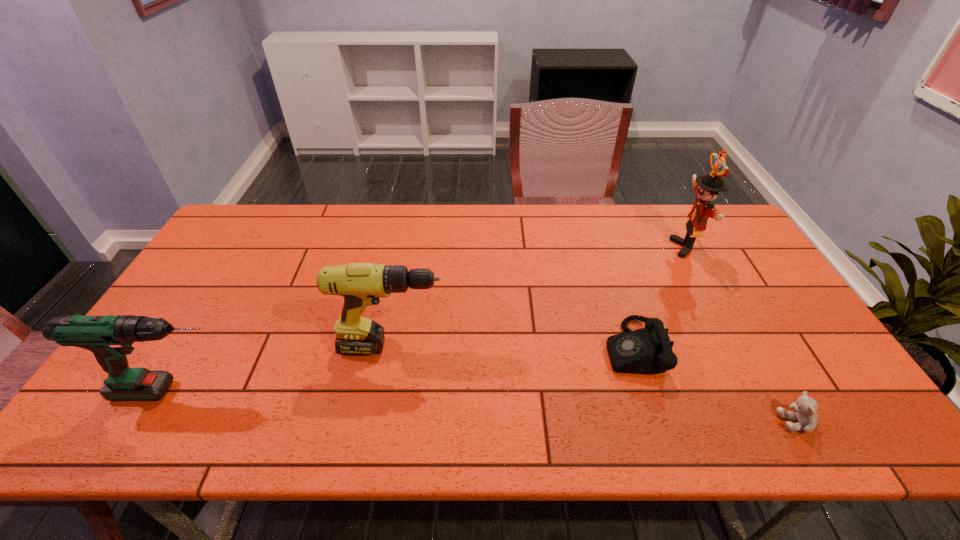
At what (x,y) coordinates should I click in order to perform the action: click on free space located 0.250m on the front-facing side of the farthest object. Please return your answer as a coordinate pair (x, y). Looking at the image, I should click on (597, 248).

Locate an element on the screen. The height and width of the screenshot is (540, 960). vacant space positioned on the handle side of the second object from left to right is located at coordinates (469, 347).

What are the coordinates of `blank space located 0.110m on the handle side of the leftmost object` in the screenshot? It's located at (286, 391).

What are the coordinates of `free spot located on the dial of the third object from right to left` in the screenshot? It's located at (460, 348).

Where is `vacant space located on the dial of the third object from right to left`? This screenshot has width=960, height=540. vacant space located on the dial of the third object from right to left is located at coordinates (452, 348).

Find the location of `vacant position located 0.130m on the dial of the third object from right to left`. vacant position located 0.130m on the dial of the third object from right to left is located at coordinates (556, 348).

The height and width of the screenshot is (540, 960). In order to click on vacant region located 0.070m on the face of the nearest object in this screenshot , I will do `click(747, 421)`.

Locate an element on the screen. The image size is (960, 540). vacant point located on the face of the nearest object is located at coordinates (685, 421).

Find the location of a particular element. The height and width of the screenshot is (540, 960). free space located on the face of the nearest object is located at coordinates (703, 421).

Image resolution: width=960 pixels, height=540 pixels. I want to click on object that is positioned at the far edge, so click(x=706, y=187).